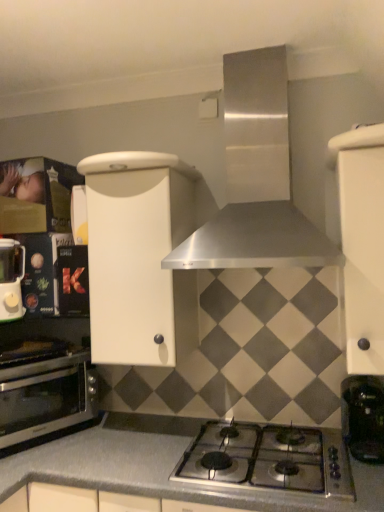
Find the location of a particular element. This screenshot has width=384, height=512. vacant area that lies to the right of stainless steel oven at lower left is located at coordinates (128, 443).